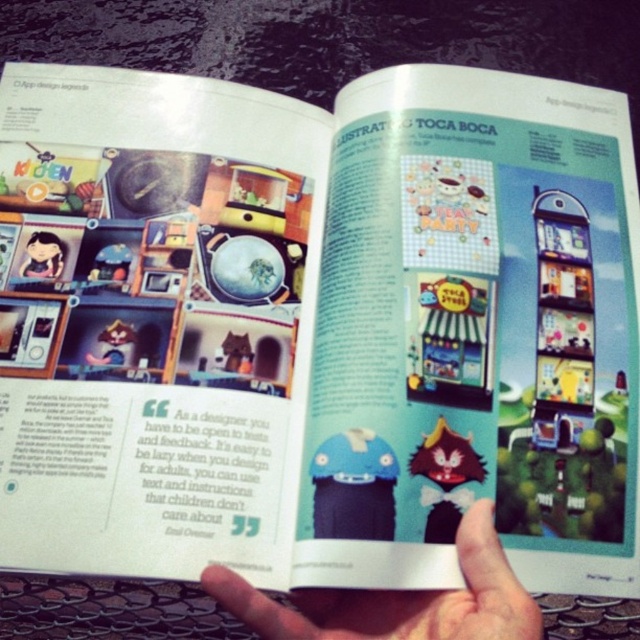
Question: Considering the relative positions of smooth skin hand at center and matte black doll at upper left in the image provided, where is smooth skin hand at center located with respect to matte black doll at upper left?

Choices:
 (A) left
 (B) right

Answer: (B)

Question: Does smooth skin hand at center have a smaller size compared to matte black doll at upper left?

Choices:
 (A) no
 (B) yes

Answer: (A)

Question: Which object is closer to the camera taking this photo?

Choices:
 (A) matte black doll at upper left
 (B) smooth skin hand at center

Answer: (B)

Question: Among these points, which one is farthest from the camera?

Choices:
 (A) (355, 595)
 (B) (26, 246)

Answer: (B)

Question: Is smooth skin hand at center closer to camera compared to matte black doll at upper left?

Choices:
 (A) yes
 (B) no

Answer: (A)